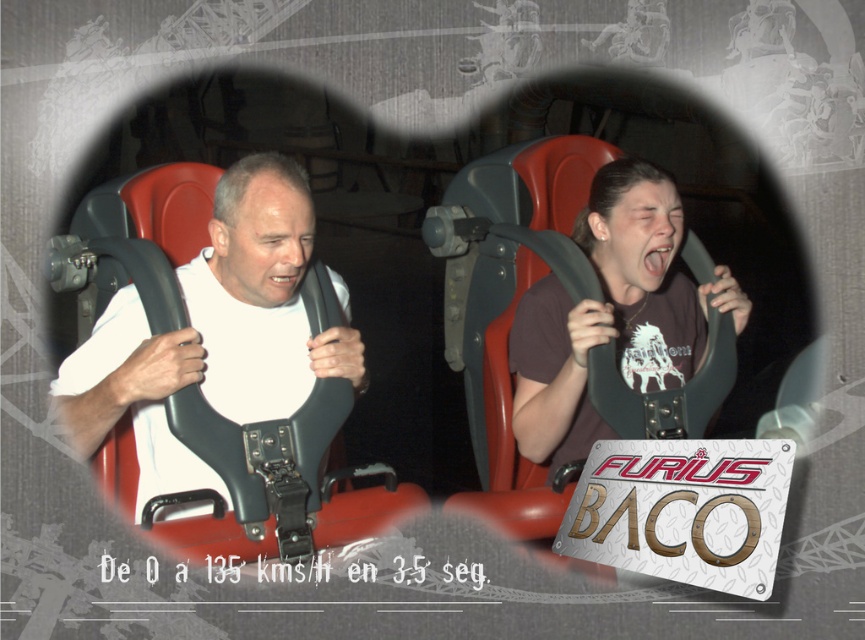
You are an amusement park safety inspector checking the seating arrangement of the Furius Baco roller coaster. According to the image, is the matte white shirt at left seated in a position that is lower than the brown matte shirt at center?

Yes, the matte white shirt at left is positioned under brown matte shirt at center, indicating that the matte white shirt at left is seated in a lower position than the brown matte shirt at center.

You are a photographer standing in front of the roller coaster scene. You want to take a photo focusing on the point closer to you. Which point should you choose between point (x=680, y=378) and point (x=755, y=564)?

Point (x=680, y=378) is further to the camera than point (x=755, y=564), so you should choose point (x=680, y=378) as it is closer to you.